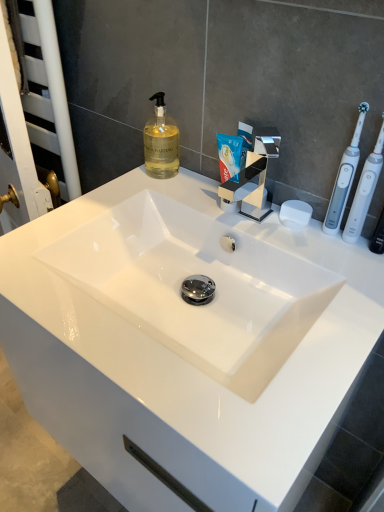
I want to click on free space that is to the left of chrome metallic tap at center, so click(160, 201).